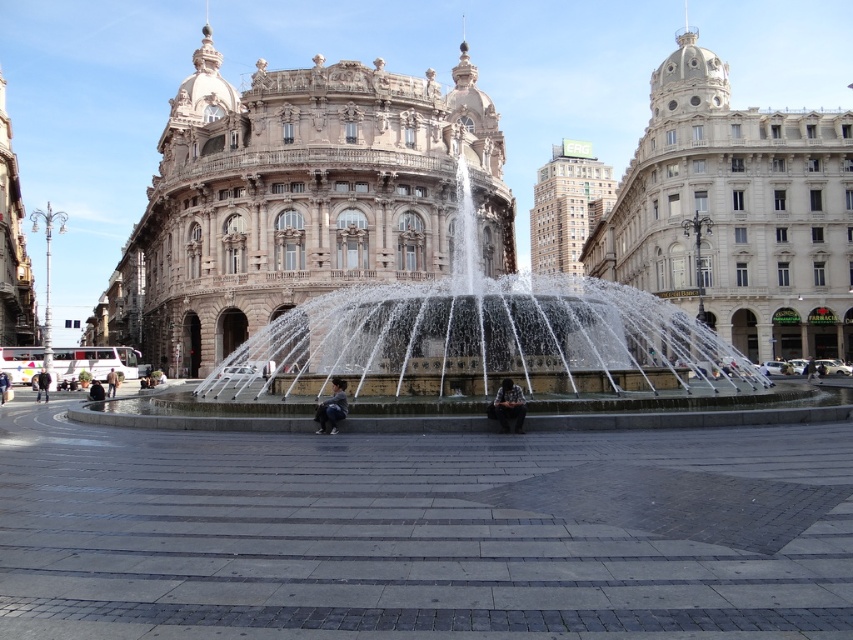
You are standing in the urban square and want to take a photo of the marble stone palace at center and the dark gray fabric jacket at center. Since you want the palace to be the main focus, which object should you position higher in your camera frame?

The marble stone palace at center is above the dark gray fabric jacket at center, so you should position the marble stone palace at center higher in your camera frame to emphasize it as the main focus.

You are standing in the urban square and notice two jackets. The black leather jacket at lower left and the brown leather jacket at center. Which jacket is positioned higher from the ground?

The black leather jacket at lower left is located above the brown leather jacket at center, so it is positioned higher from the ground.

You are standing in the urban square and see the white marble building at center and the black fabric bag at center. Which object is located to the right of the other?

The white marble building at center is positioned on the right side of black fabric bag at center.